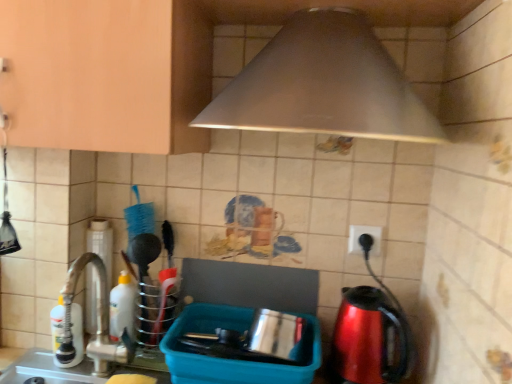
Question: Considering the relative sizes of metallic stainless steel pot at center, positioned as the 2th appliance in left-to-right order, and brushed metal faucet at left, marked as the 1th appliance in a left-to-right arrangement, in the image provided, is metallic stainless steel pot at center, positioned as the 2th appliance in left-to-right order, bigger than brushed metal faucet at left, marked as the 1th appliance in a left-to-right arrangement,?

Choices:
 (A) no
 (B) yes

Answer: (B)

Question: Does metallic stainless steel pot at center, positioned as the 2th appliance in left-to-right order, appear on the right side of brushed metal faucet at left, which ranks as the second appliance in right-to-left order?

Choices:
 (A) no
 (B) yes

Answer: (B)

Question: Does metallic stainless steel pot at center, the 1th appliance viewed from the right, have a lesser width compared to brushed metal faucet at left, marked as the 1th appliance in a left-to-right arrangement?

Choices:
 (A) yes
 (B) no

Answer: (B)

Question: Is metallic stainless steel pot at center, the 1th appliance viewed from the right, positioned beyond the bounds of brushed metal faucet at left, which ranks as the second appliance in right-to-left order?

Choices:
 (A) yes
 (B) no

Answer: (A)

Question: Would you say metallic stainless steel pot at center, the 1th appliance viewed from the right, is a long distance from brushed metal faucet at left, marked as the 1th appliance in a left-to-right arrangement?

Choices:
 (A) yes
 (B) no

Answer: (B)

Question: Is metallic stainless steel pot at center, the 1th appliance viewed from the right, directly adjacent to brushed metal faucet at left, marked as the 1th appliance in a left-to-right arrangement?

Choices:
 (A) yes
 (B) no

Answer: (B)

Question: From the image's perspective, would you say metallic stainless steel pot at center, the 1th appliance viewed from the right, is positioned over shiny metallic kettle at right?

Choices:
 (A) yes
 (B) no

Answer: (B)

Question: Is metallic stainless steel pot at center, positioned as the 2th appliance in left-to-right order, at the right side of shiny metallic kettle at right?

Choices:
 (A) yes
 (B) no

Answer: (B)

Question: Is metallic stainless steel pot at center, the 1th appliance viewed from the right, positioned in front of shiny metallic kettle at right?

Choices:
 (A) no
 (B) yes

Answer: (A)

Question: Is metallic stainless steel pot at center, positioned as the 2th appliance in left-to-right order, outside shiny metallic kettle at right?

Choices:
 (A) no
 (B) yes

Answer: (B)

Question: Is metallic stainless steel pot at center, positioned as the 2th appliance in left-to-right order, looking in the opposite direction of shiny metallic kettle at right?

Choices:
 (A) yes
 (B) no

Answer: (B)

Question: Does metallic stainless steel pot at center, positioned as the 2th appliance in left-to-right order, lie behind shiny metallic kettle at right?

Choices:
 (A) no
 (B) yes

Answer: (B)

Question: From the image's perspective, is white plastic bottle at left, the 2th bottle from the front, on top of white glossy bottle at left, which appears as the 2th bottle when viewed from the back?

Choices:
 (A) yes
 (B) no

Answer: (A)